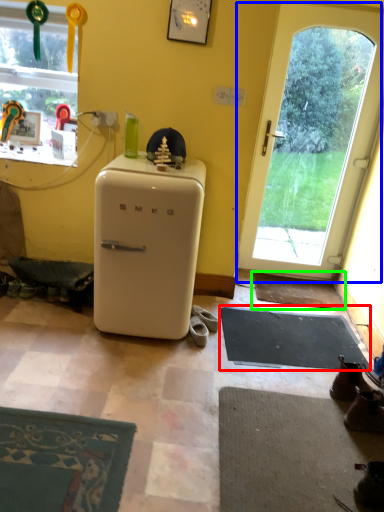
Question: Based on their relative distances, which object is farther from yoga mat (highlighted by a red box)? Choose from door (highlighted by a blue box) and doormat (highlighted by a green box).

Choices:
 (A) door
 (B) doormat

Answer: (A)